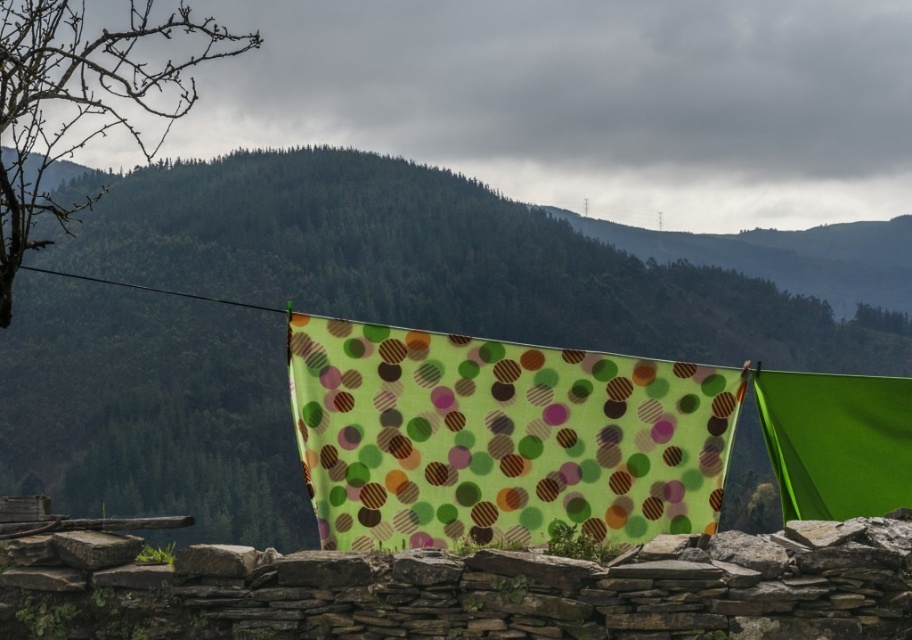
You are planning to hang a new decoration between the green fabric at center and the bare branches at left. Which object is taller so you know where to place the decoration higher?

The bare branches at left are taller than the green fabric at center, so you should place the decoration higher near the bare branches at left.

You are an observer standing in front of the stone wall. You see the green fabric at center and the black wire at upper left. Which object is higher in position?

The green fabric at center is taller than the black wire at upper left.